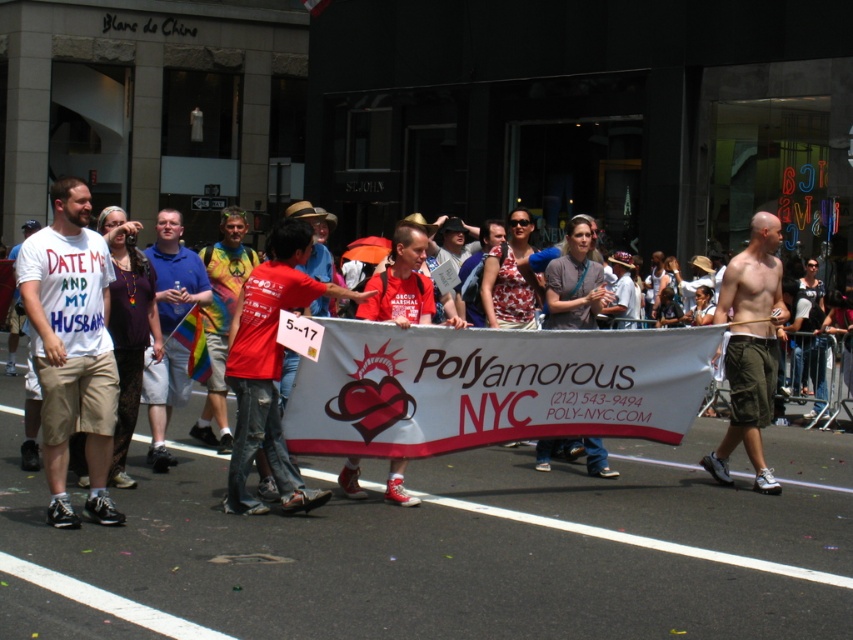
Question: Where is white cotton t-shirt at left located in relation to shiny khaki shorts at right in the image?

Choices:
 (A) right
 (B) left

Answer: (B)

Question: Estimate the real-world distances between objects in this image. Which object is farther from the red cotton shirt at center?

Choices:
 (A) white banner at center
 (B) white cotton t-shirt at left

Answer: (B)

Question: Is the position of white banner at center less distant than that of red cotton shirt at center?

Choices:
 (A) no
 (B) yes

Answer: (A)

Question: Is white banner at center positioned at the back of red cotton shirt at center?

Choices:
 (A) no
 (B) yes

Answer: (B)

Question: Estimate the real-world distances between objects in this image. Which object is closer to the white banner at center?

Choices:
 (A) red cotton shirt at center
 (B) red shirt at center
 (C) shiny khaki shorts at right
 (D) white cotton t-shirt at left

Answer: (A)

Question: Which point is closer to the camera?

Choices:
 (A) red shirt at center
 (B) white cotton t-shirt at left
 (C) red cotton shirt at center

Answer: (B)